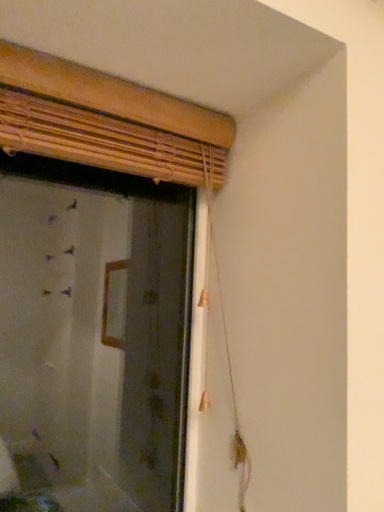
Locate an element on the screen. This screenshot has height=512, width=384. natural wood screen door at upper left is located at coordinates (94, 335).

This screenshot has width=384, height=512. Describe the element at coordinates (94, 335) in the screenshot. I see `natural wood screen door at upper left` at that location.

At what (x,y) coordinates should I click in order to perform the action: click on natural wood screen door at upper left. Please return your answer as a coordinate pair (x, y). Looking at the image, I should click on (94, 335).